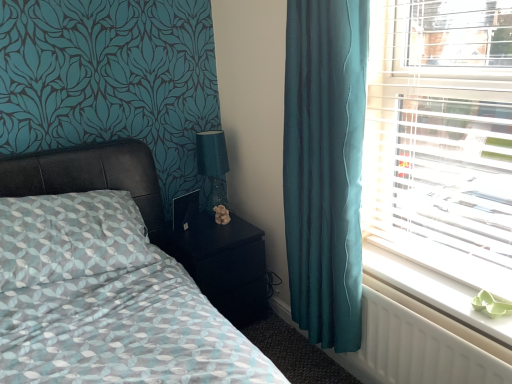
In order to face white plastic blinds at right, should I rotate leftwards or rightwards?

Rotate right and turn 24.342 degrees.

What do you see at coordinates (419, 345) in the screenshot? This screenshot has height=384, width=512. I see `white plastic radiator at lower right` at bounding box center [419, 345].

This screenshot has width=512, height=384. I want to click on black glossy nightstand at center, so click(x=222, y=264).

Based on the photo, what is the approximate height of teal glass table lamp at upper right?

teal glass table lamp at upper right is 19.03 inches tall.

Locate an element on the screen. Image resolution: width=512 pixels, height=384 pixels. matte black bed at left is located at coordinates (106, 286).

Is teal glass table lamp at upper right at the back of white plastic radiator at lower right?

No, white plastic radiator at lower right is not facing away from teal glass table lamp at upper right.

Which of these two, white plastic radiator at lower right or teal glass table lamp at upper right, is wider?

teal glass table lamp at upper right is wider.

Considering the sizes of objects white plastic radiator at lower right and teal glass table lamp at upper right in the image provided, who is taller, white plastic radiator at lower right or teal glass table lamp at upper right?

teal glass table lamp at upper right is taller.

I want to click on window sill that appears on the right of teal glass table lamp at upper right, so click(x=434, y=290).

Considering the sizes of objects white plastic radiator at lower right and black glossy nightstand at center in the image provided, who is bigger, white plastic radiator at lower right or black glossy nightstand at center?

black glossy nightstand at center is bigger.

From the image's perspective, is white plastic radiator at lower right above or below black glossy nightstand at center?

white plastic radiator at lower right is situated lower than black glossy nightstand at center in the image.

Where is `radiator below the black glossy nightstand at center (from the image's perspective)`? Image resolution: width=512 pixels, height=384 pixels. radiator below the black glossy nightstand at center (from the image's perspective) is located at coordinates (419, 345).

Is white plastic radiator at lower right not within white plastic radiator at lower right?

white plastic radiator at lower right lies outside white plastic radiator at lower right's area.

Is point (447, 289) positioned before point (365, 314)?

Yes, point (447, 289) is in front of point (365, 314).

Based on the photo, considering the positions of objects white plastic radiator at lower right and white plastic radiator at lower right in the image provided, who is more to the right, white plastic radiator at lower right or white plastic radiator at lower right?

white plastic radiator at lower right is more to the right.

Image resolution: width=512 pixels, height=384 pixels. What are the coordinates of `radiator below the white plastic radiator at lower right (from a real-world perspective)` in the screenshot? It's located at (419, 345).

How much distance is there between black glossy nightstand at center and teal glass table lamp at upper right?

They are 11.96 inches apart.

Consider the image. From a real-world perspective, between black glossy nightstand at center and teal glass table lamp at upper right, who is vertically lower?

black glossy nightstand at center, from a real-world perspective.

Where is `table lamp above the black glossy nightstand at center (from the image's perspective)`? Image resolution: width=512 pixels, height=384 pixels. table lamp above the black glossy nightstand at center (from the image's perspective) is located at coordinates (214, 169).

Consider the image. From the image's perspective, would you say black glossy nightstand at center is positioned over teal glass table lamp at upper right?

Actually, black glossy nightstand at center appears below teal glass table lamp at upper right in the image.

From the image's perspective, does white plastic blinds at right appear lower than matte black bed at left?

No, from the image's perspective, white plastic blinds at right is not below matte black bed at left.

How much distance is there between white plastic blinds at right and matte black bed at left?

They are 1.03 meters apart.

Is white plastic blinds at right positioned beyond the bounds of matte black bed at left?

That's correct, white plastic blinds at right is outside of matte black bed at left.

Identify the location of window above the matte black bed at left (from the image's perspective). (441, 137).

Can you tell me how much teal glass table lamp at upper right and white plastic radiator at lower right differ in facing direction?

The angular difference between teal glass table lamp at upper right and white plastic radiator at lower right is 88.9 degrees.

From a real-world perspective, which is physically below, teal glass table lamp at upper right or white plastic radiator at lower right?

From a 3D spatial view, white plastic radiator at lower right is below.

Find the location of a particular element. The image size is (512, 384). window sill below the teal glass table lamp at upper right (from the image's perspective) is located at coordinates (434, 290).

Does teal glass table lamp at upper right have a smaller size compared to white plastic radiator at lower right?

No, teal glass table lamp at upper right is not smaller than white plastic radiator at lower right.

In terms of width, does teal fabric curtain at right look wider or thinner when compared to white plastic radiator at lower right?

In the image, teal fabric curtain at right appears to be wider than white plastic radiator at lower right.

Which is farther from the camera, (352,333) or (395,278)?

Positioned behind is point (352,333).

This screenshot has width=512, height=384. Identify the location of curtain on the left of white plastic radiator at lower right. (325, 166).

From their relative heights in the image, would you say teal fabric curtain at right is taller or shorter than white plastic radiator at lower right?

Clearly, teal fabric curtain at right is taller compared to white plastic radiator at lower right.

Locate an element on the screen. window sill below the teal glass table lamp at upper right (from a real-world perspective) is located at coordinates (434, 290).

Where is `nightstand that is on the left side of white plastic radiator at lower right`? nightstand that is on the left side of white plastic radiator at lower right is located at coordinates (222, 264).

Based on their spatial positions, is teal fabric curtain at right or teal glass table lamp at upper right closer to black glossy nightstand at center?

teal glass table lamp at upper right is closer to black glossy nightstand at center.

In the scene shown: Based on their spatial positions, is black glossy nightstand at center or white plastic blinds at right further from teal fabric curtain at right?

Among the two, black glossy nightstand at center is located further to teal fabric curtain at right.

Which object lies nearer to the anchor point teal glass table lamp at upper right, matte black bed at left or white plastic radiator at lower right?

The object closer to teal glass table lamp at upper right is matte black bed at left.

Consider the image. Estimate the real-world distances between objects in this image. Which object is closer to black glossy nightstand at center, white plastic radiator at lower right or white plastic radiator at lower right?

Among the two, white plastic radiator at lower right is located nearer to black glossy nightstand at center.

From the image, which object appears to be nearer to teal glass table lamp at upper right, white plastic radiator at lower right or white plastic blinds at right?

white plastic radiator at lower right is positioned closer to the anchor teal glass table lamp at upper right.

Considering their positions, is white plastic blinds at right positioned further to matte black bed at left than white plastic radiator at lower right?

white plastic blinds at right is further to matte black bed at left.

Considering their positions, is white plastic blinds at right positioned closer to matte black bed at left than teal fabric curtain at right?

The object closer to matte black bed at left is teal fabric curtain at right.

Based on the photo, which object lies nearer to the anchor point white plastic radiator at lower right, matte black bed at left or teal glass table lamp at upper right?

matte black bed at left is positioned closer to the anchor white plastic radiator at lower right.

In order to click on nightstand between matte black bed at left and white plastic blinds at right from left to right in this screenshot , I will do `click(222, 264)`.

Where is `nightstand between matte black bed at left and teal fabric curtain at right from left to right`? This screenshot has height=384, width=512. nightstand between matte black bed at left and teal fabric curtain at right from left to right is located at coordinates [x=222, y=264].

You are a GUI agent. You are given a task and a screenshot of the screen. Output one action in this format:
    pyautogui.click(x=<x>, y=<y>)
    Task: Click on the nightstand located between matte black bed at left and white plastic radiator at lower right in the left-right direction
    
    Given the screenshot: What is the action you would take?
    [x=222, y=264]

Locate an element on the screen. This screenshot has width=512, height=384. radiator situated between black glossy nightstand at center and white plastic radiator at lower right from left to right is located at coordinates (419, 345).